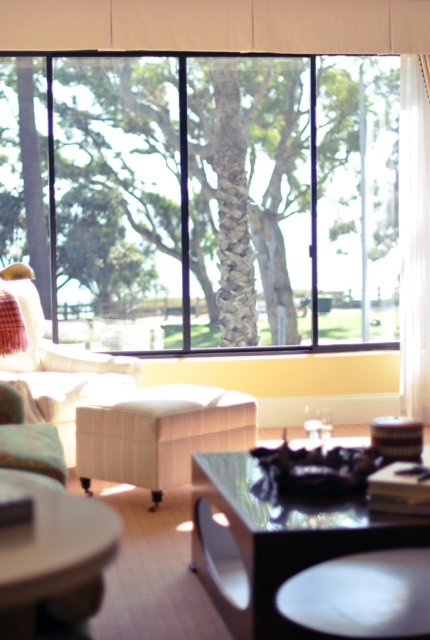
You are standing in the living room and want to know how far the point at coordinates (248,22) is from you. Can you determine the distance?

The point at coordinates (248,22) is 6.19 meters away from the viewer.

You are sitting on the plaid fabric armchair at left and want to look out the window. Can you see the white fabric curtain at upper center blocking your view?

The white fabric curtain at upper center is located above the plaid fabric armchair at left, so when sitting on the plaid fabric armchair at left, the curtain would be above your line of sight and not blocking your direct view out the window.

You are planning to move a rectangular box that is 1.2 meters wide. You want to place it between the transparent glass coffee table at center and the plaid fabric armchair at left. Based on the space between them, will the box fit?

The transparent glass coffee table at center is thinner than the plaid fabric armchair at left, so the space between them may vary. However, since the box is 1.2 meters wide, it might not fit if the distance between the two objects is less than 1.2 meters. Without exact measurements, it is uncertain.